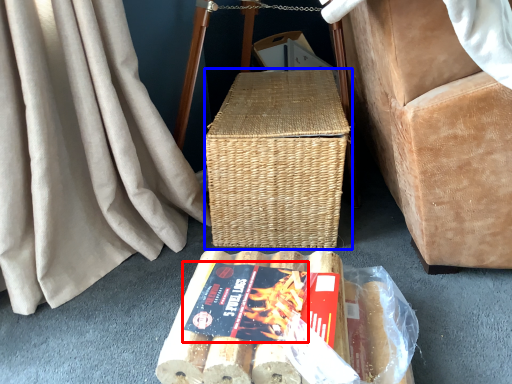
Question: Which object appears closest to the camera in this image, paperback book (highlighted by a red box) or picnic basket (highlighted by a blue box)?

Choices:
 (A) paperback book
 (B) picnic basket

Answer: (A)